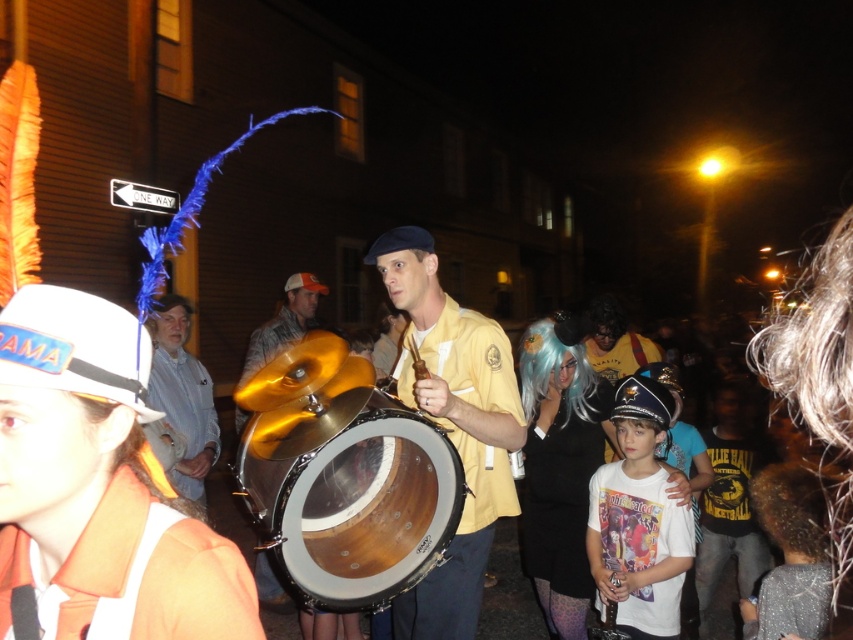
Question: Is wooden drum at center further to the viewer compared to gold metallic drum at center?

Choices:
 (A) no
 (B) yes

Answer: (A)

Question: Does wooden drum at center appear on the left side of white matte shirt at center?

Choices:
 (A) yes
 (B) no

Answer: (A)

Question: Which of the following is the farthest from the observer?

Choices:
 (A) shiny gold drum at center
 (B) gold metallic drum at center

Answer: (B)

Question: Which of these objects is positioned farthest from the sparkly gray dress at lower right?

Choices:
 (A) white matte shirt at center
 (B) gold metallic drum at center
 (C) shiny gold drum at center

Answer: (B)

Question: Can you confirm if shiny gold drum at center is bigger than sparkly gray dress at lower right?

Choices:
 (A) yes
 (B) no

Answer: (A)

Question: Among these points, which one is nearest to the camera?

Choices:
 (A) (796, 506)
 (B) (157, 369)
 (C) (656, 515)

Answer: (A)